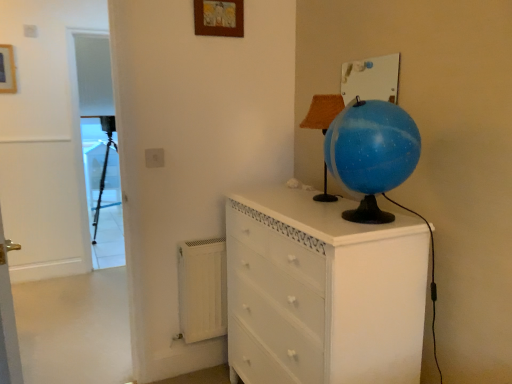
Question: Does wooden picture frame at upper center, the second picture frame from the left, come behind white matte radiator at lower left?

Choices:
 (A) yes
 (B) no

Answer: (B)

Question: From a real-world perspective, is wooden picture frame at upper center, the second picture frame from the left, physically below white matte radiator at lower left?

Choices:
 (A) no
 (B) yes

Answer: (A)

Question: Considering the relative sizes of wooden picture frame at upper center, the second picture frame from the left, and white matte radiator at lower left in the image provided, is wooden picture frame at upper center, the second picture frame from the left, bigger than white matte radiator at lower left?

Choices:
 (A) yes
 (B) no

Answer: (B)

Question: Does wooden picture frame at upper center, the second picture frame from the left, touch white matte radiator at lower left?

Choices:
 (A) no
 (B) yes

Answer: (A)

Question: Does wooden picture frame at upper center, the second picture frame from the left, have a lesser width compared to white matte radiator at lower left?

Choices:
 (A) yes
 (B) no

Answer: (A)

Question: From the image's perspective, is wooden picture frame at upper center, which is the first picture frame in right-to-left order, above white matte radiator at lower left?

Choices:
 (A) no
 (B) yes

Answer: (B)

Question: Can you confirm if burlap-textured lampshade at upper center is wider than wooden picture frame at upper left, the 2th picture frame in the front-to-back sequence?

Choices:
 (A) no
 (B) yes

Answer: (B)

Question: Is burlap-textured lampshade at upper center outside of wooden picture frame at upper left, which is the 2th picture frame in right-to-left order?

Choices:
 (A) yes
 (B) no

Answer: (A)

Question: From a real-world perspective, is burlap-textured lampshade at upper center located beneath wooden picture frame at upper left, the 2th picture frame in the front-to-back sequence?

Choices:
 (A) no
 (B) yes

Answer: (B)

Question: Is burlap-textured lampshade at upper center bigger than wooden picture frame at upper left, which is counted as the first picture frame, starting from the left?

Choices:
 (A) no
 (B) yes

Answer: (B)

Question: Can you confirm if burlap-textured lampshade at upper center is positioned to the right of wooden picture frame at upper left, the 2th picture frame in the front-to-back sequence?

Choices:
 (A) yes
 (B) no

Answer: (A)

Question: Does burlap-textured lampshade at upper center lie behind wooden picture frame at upper left, the 2th picture frame in the front-to-back sequence?

Choices:
 (A) no
 (B) yes

Answer: (A)

Question: Is white matte radiator at lower left aimed at white painted wood chest of drawers at center?

Choices:
 (A) no
 (B) yes

Answer: (B)